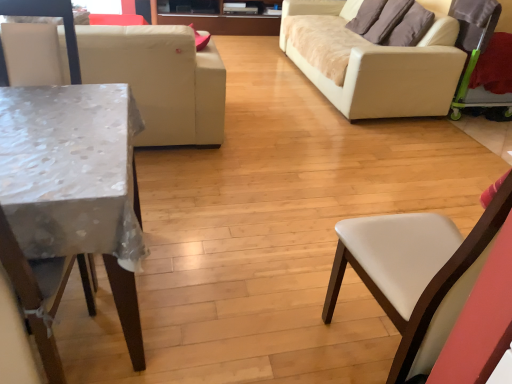
The width and height of the screenshot is (512, 384). Identify the location of vacant space underneath green plastic swivel chair at right (from a real-world perspective). (472, 120).